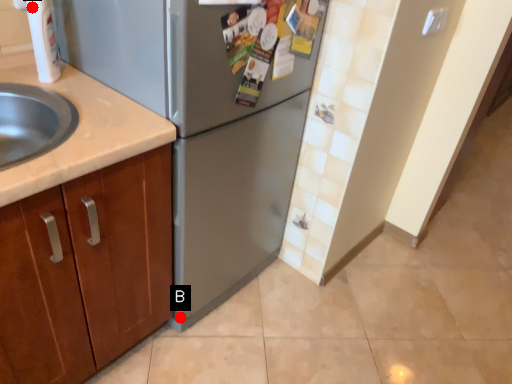
Question: Two points are circled on the image, labeled by A and B beside each circle. Which point appears farthest from the camera in this image?

Choices:
 (A) A is further
 (B) B is further

Answer: (B)